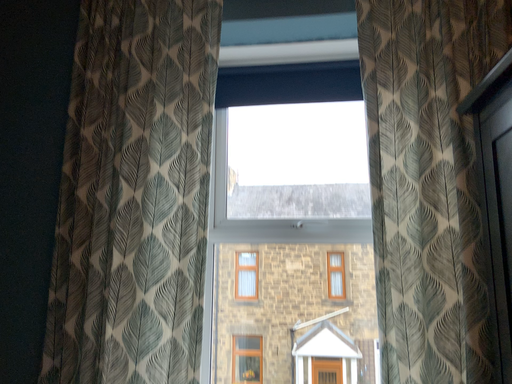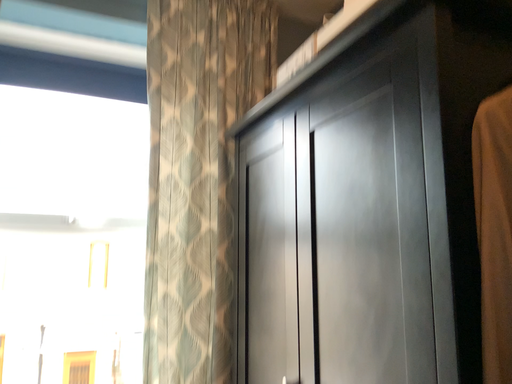
Question: Which way did the camera rotate in the video?

Choices:
 (A) rotated right
 (B) rotated left

Answer: (A)